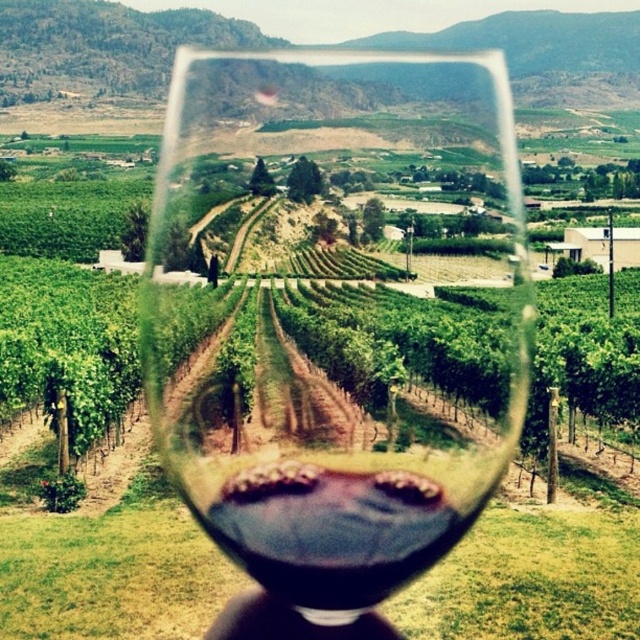
Does transparent glass at center appear on the left side of black matte hand at lower center?

In fact, transparent glass at center is to the right of black matte hand at lower center.

Measure the distance between transparent glass at center and camera.

transparent glass at center is 3.57 feet from camera.

The height and width of the screenshot is (640, 640). Describe the element at coordinates (330, 323) in the screenshot. I see `transparent glass at center` at that location.

What are the coordinates of `transparent glass at center` in the screenshot? It's located at (330, 323).

Does transparent glass at center come in front of dark red liquid at center?

No, transparent glass at center is further to the viewer.

Is transparent glass at center to the left of dark red liquid at center from the viewer's perspective?

No, transparent glass at center is not to the left of dark red liquid at center.

Between point (230, 141) and point (419, 474), which one is positioned behind?

The point (419, 474) is behind.

Image resolution: width=640 pixels, height=640 pixels. Find the location of `transparent glass at center`. transparent glass at center is located at coordinates (330, 323).

Can you confirm if dark red liquid at center is positioned to the left of black matte hand at lower center?

No, dark red liquid at center is not to the left of black matte hand at lower center.

Where is `dark red liquid at center`? This screenshot has height=640, width=640. dark red liquid at center is located at coordinates (333, 531).

Image resolution: width=640 pixels, height=640 pixels. What do you see at coordinates (333, 531) in the screenshot?
I see `dark red liquid at center` at bounding box center [333, 531].

The height and width of the screenshot is (640, 640). I want to click on dark red liquid at center, so click(333, 531).